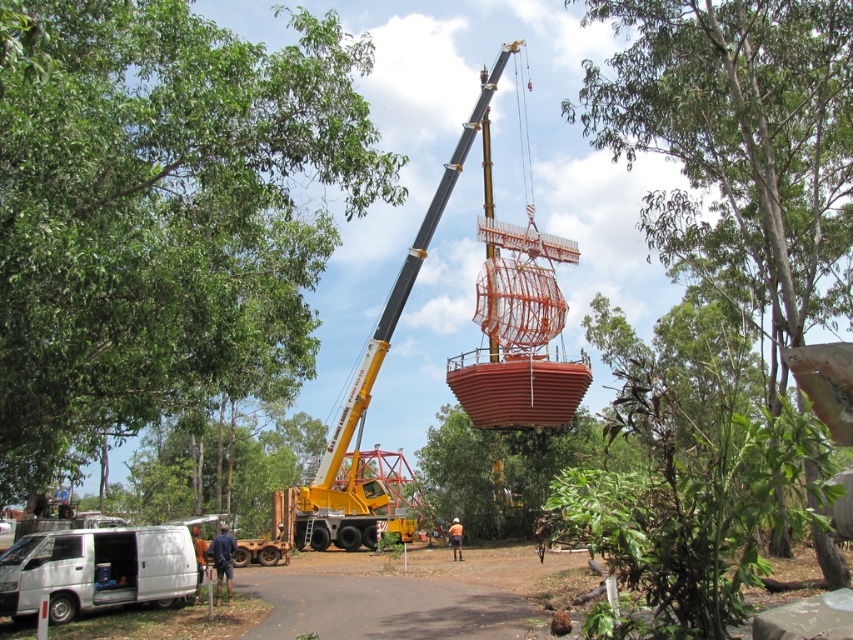
Which is below, green leafy tree at center or brown leather jacket at lower left?

brown leather jacket at lower left is lower down.

Does green leafy tree at center have a greater width compared to brown leather jacket at lower left?

Yes, green leafy tree at center is wider than brown leather jacket at lower left.

The image size is (853, 640). What do you see at coordinates (498, 468) in the screenshot?
I see `green leafy tree at center` at bounding box center [498, 468].

Where is `green leafy tree at center`? green leafy tree at center is located at coordinates (498, 468).

Which is above, green leafy tree at upper center or green leafy tree at center?

Positioned higher is green leafy tree at upper center.

Does green leafy tree at upper center appear over green leafy tree at center?

Yes, green leafy tree at upper center is above green leafy tree at center.

The image size is (853, 640). I want to click on green leafy tree at upper center, so click(x=738, y=145).

Describe the element at coordinates (738, 145) in the screenshot. Image resolution: width=853 pixels, height=640 pixels. I see `green leafy tree at upper center` at that location.

Can you confirm if green leafy tree at upper center is taller than brown leather jacket at lower left?

Yes, green leafy tree at upper center is taller than brown leather jacket at lower left.

Is point (643, 93) positioned after point (227, 548)?

No, (643, 93) is closer to viewer.

Find the location of a particular element. The image size is (853, 640). green leafy tree at upper center is located at coordinates (738, 145).